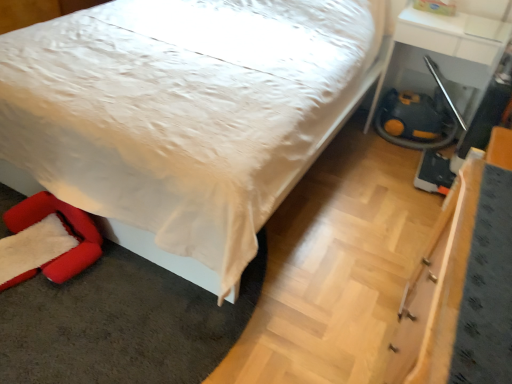
This screenshot has height=384, width=512. Describe the element at coordinates (65, 229) in the screenshot. I see `velvet red swivel chair at lower left` at that location.

You are a GUI agent. You are given a task and a screenshot of the screen. Output one action in this format:
    pyautogui.click(x=<x>, y=<y>)
    Task: Click on the white satin bed at center
    This screenshot has width=512, height=384.
    Given the screenshot: What is the action you would take?
    pyautogui.click(x=327, y=121)

The width and height of the screenshot is (512, 384). Describe the element at coordinates (450, 81) in the screenshot. I see `white glossy table at lower right` at that location.

This screenshot has width=512, height=384. Find the location of `velvet red swivel chair at lower left`. velvet red swivel chair at lower left is located at coordinates (65, 229).

Considering the relative positions of velvet red swivel chair at lower left and white satin bed at center in the image provided, is velvet red swivel chair at lower left to the left or to the right of white satin bed at center?

Based on their positions, velvet red swivel chair at lower left is located to the left of white satin bed at center.

Can you see velvet red swivel chair at lower left touching white satin bed at center?

velvet red swivel chair at lower left is not next to white satin bed at center, and they're not touching.

From a real-world perspective, who is located higher, velvet red swivel chair at lower left or white satin bed at center?

In real-world perspective, white satin bed at center is above.

Can you confirm if velvet red swivel chair at lower left is smaller than white satin bed at center?

Indeed, velvet red swivel chair at lower left has a smaller size compared to white satin bed at center.

Considering the sizes of white satin bed at center and white glossy table at lower right in the image, is white satin bed at center wider or thinner than white glossy table at lower right?

In the image, white satin bed at center appears to be wider than white glossy table at lower right.

This screenshot has width=512, height=384. Identify the location of table lying behind the white satin bed at center. (450, 81).

Considering the positions of objects white satin bed at center and white glossy table at lower right in the image provided, who is more to the right, white satin bed at center or white glossy table at lower right?

Positioned to the right is white glossy table at lower right.

Considering the positions of objects white satin bed at center and white glossy table at lower right in the image provided, who is in front, white satin bed at center or white glossy table at lower right?

white satin bed at center is in front.

Considering the relative positions of white satin bed at center and velvet red swivel chair at lower left in the image provided, is white satin bed at center to the right of velvet red swivel chair at lower left from the viewer's perspective?

Yes, white satin bed at center is to the right of velvet red swivel chair at lower left.

Is white satin bed at center bigger than velvet red swivel chair at lower left?

Yes.

Consider the image. Does white satin bed at center come behind velvet red swivel chair at lower left?

No.

Is white satin bed at center looking in the opposite direction of velvet red swivel chair at lower left?

No, white satin bed at center's orientation is not away from velvet red swivel chair at lower left.

In the image, there is a white satin bed at center. Find the location of `table below it (from a real-world perspective)`. table below it (from a real-world perspective) is located at coordinates (450, 81).

Could you tell me if white glossy table at lower right is turned towards white satin bed at center?

No.

Is white glossy table at lower right not near white satin bed at center?

No, white glossy table at lower right is not far from white satin bed at center.

Considering the relative sizes of white glossy table at lower right and white satin bed at center in the image provided, is white glossy table at lower right bigger than white satin bed at center?

Actually, white glossy table at lower right might be smaller than white satin bed at center.

Is velvet red swivel chair at lower left at the left side of white glossy table at lower right?

Yes.

Is velvet red swivel chair at lower left oriented away from white glossy table at lower right?

Yes, velvet red swivel chair at lower left is facing away from white glossy table at lower right.

From a real-world perspective, which is physically below, velvet red swivel chair at lower left or white glossy table at lower right?

velvet red swivel chair at lower left, from a real-world perspective.

Considering the positions of points (14, 223) and (470, 147), is point (14, 223) farther from camera compared to point (470, 147)?

No, (14, 223) is in front of (470, 147).

I want to click on table behind the velvet red swivel chair at lower left, so click(x=450, y=81).

From a real-world perspective, between white glossy table at lower right and velvet red swivel chair at lower left, who is vertically higher?

From a 3D spatial view, white glossy table at lower right is above.

Considering their positions, is white glossy table at lower right located in front of or behind velvet red swivel chair at lower left?

Clearly, white glossy table at lower right is behind velvet red swivel chair at lower left.

At what (x,y) coordinates should I click in order to perform the action: click on swivel chair below the white satin bed at center (from the image's perspective). Please return your answer as a coordinate pair (x, y). The image size is (512, 384). Looking at the image, I should click on (65, 229).

At what (x,y) coordinates should I click in order to perform the action: click on bed above the white glossy table at lower right (from the image's perspective). Please return your answer as a coordinate pair (x, y). Looking at the image, I should click on (327, 121).

Based on their spatial positions, is white satin bed at center or white glossy table at lower right further from velvet red swivel chair at lower left?

white glossy table at lower right lies further to velvet red swivel chair at lower left than the other object.

When comparing their distances from white satin bed at center, does white glossy table at lower right or velvet red swivel chair at lower left seem further?

Among the two, white glossy table at lower right is located further to white satin bed at center.

Looking at the image, which one is located closer to white satin bed at center, velvet red swivel chair at lower left or white glossy table at lower right?

velvet red swivel chair at lower left lies closer to white satin bed at center than the other object.

When comparing their distances from white glossy table at lower right, does velvet red swivel chair at lower left or white satin bed at center seem further?

Among the two, velvet red swivel chair at lower left is located further to white glossy table at lower right.

When comparing their distances from white glossy table at lower right, does white satin bed at center or velvet red swivel chair at lower left seem closer?

white satin bed at center lies closer to white glossy table at lower right than the other object.

When comparing their distances from velvet red swivel chair at lower left, does white glossy table at lower right or white satin bed at center seem closer?

white satin bed at center lies closer to velvet red swivel chair at lower left than the other object.

Identify the location of bed between velvet red swivel chair at lower left and white glossy table at lower right. Image resolution: width=512 pixels, height=384 pixels. (327, 121).